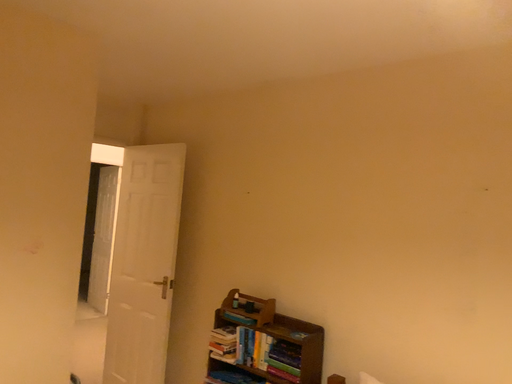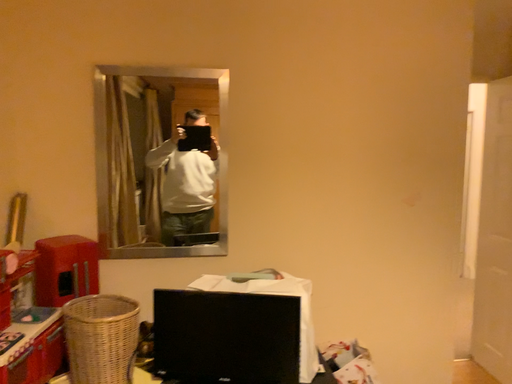
Question: Which way did the camera rotate in the video?

Choices:
 (A) rotated right
 (B) rotated left

Answer: (B)